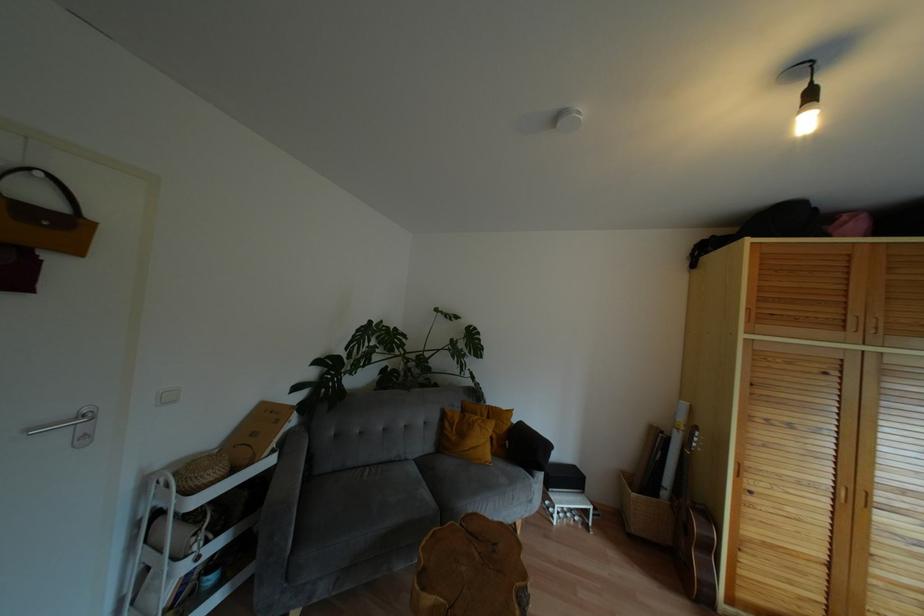
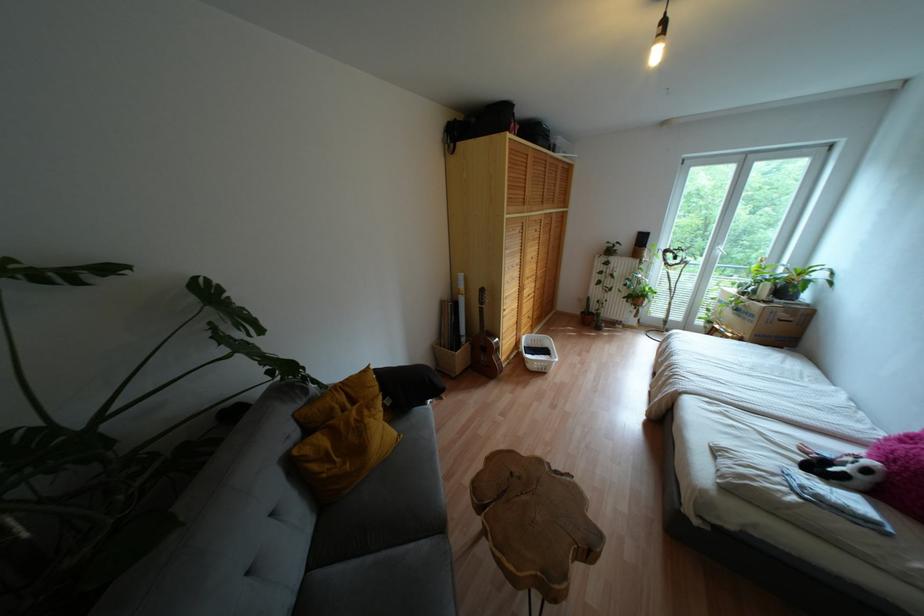
The point at (451, 424) is marked in the first image. Where is the corresponding point in the second image?

(325, 458)